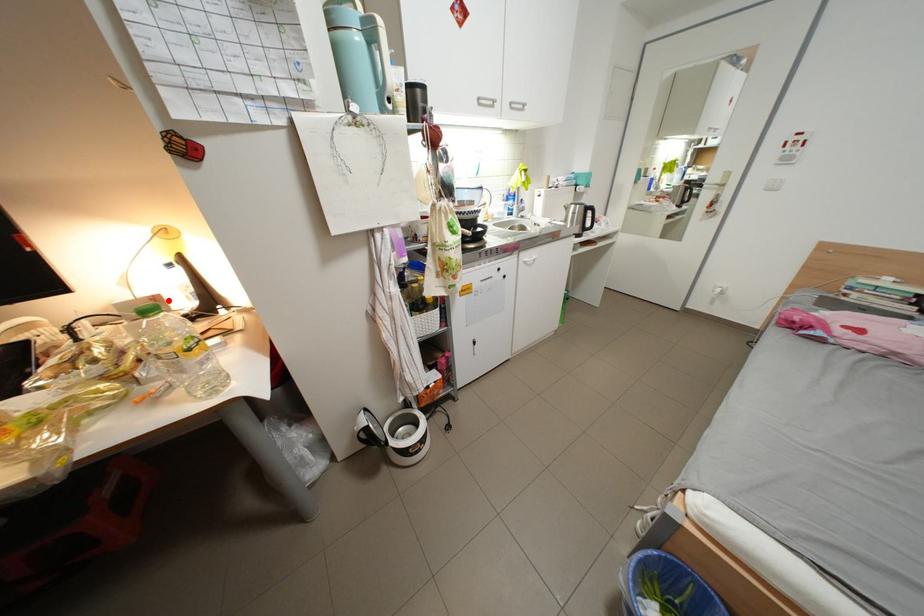
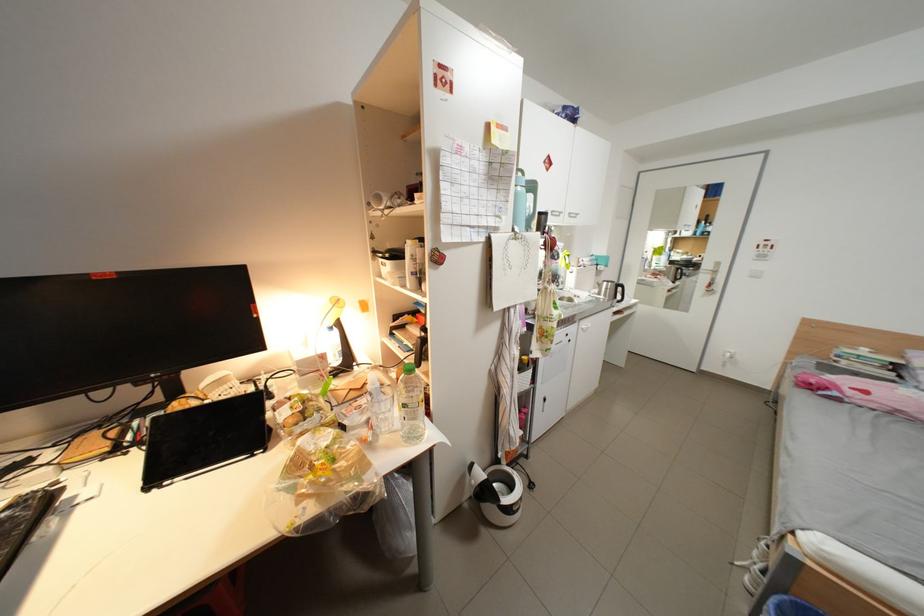
In the second image, find the point that corresponds to the highlighted location in the first image.

(334, 358)